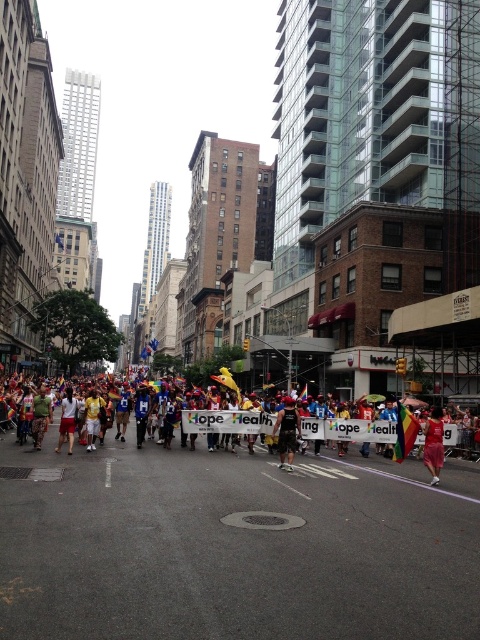
Question: Among these points, which one is farthest from the camera?

Choices:
 (A) (39, 385)
 (B) (71, 390)
 (C) (428, 435)

Answer: (A)

Question: Does white cotton shorts at center lie in front of yellow fabric at center?

Choices:
 (A) no
 (B) yes

Answer: (B)

Question: Which point is closer to the camera?

Choices:
 (A) (93, 433)
 (B) (73, 412)
 (C) (434, 436)
 (D) (78, 445)

Answer: (C)

Question: Does multicolored fabric at center have a smaller size compared to yellow fabric at center?

Choices:
 (A) no
 (B) yes

Answer: (A)

Question: Can you confirm if multicolored fabric banner at center is positioned above yellow fabric at center?

Choices:
 (A) no
 (B) yes

Answer: (A)

Question: Which point is closer to the camera taking this photo?

Choices:
 (A) (34, 401)
 (B) (94, 408)
 (C) (73, 420)
 (D) (75, 452)

Answer: (D)